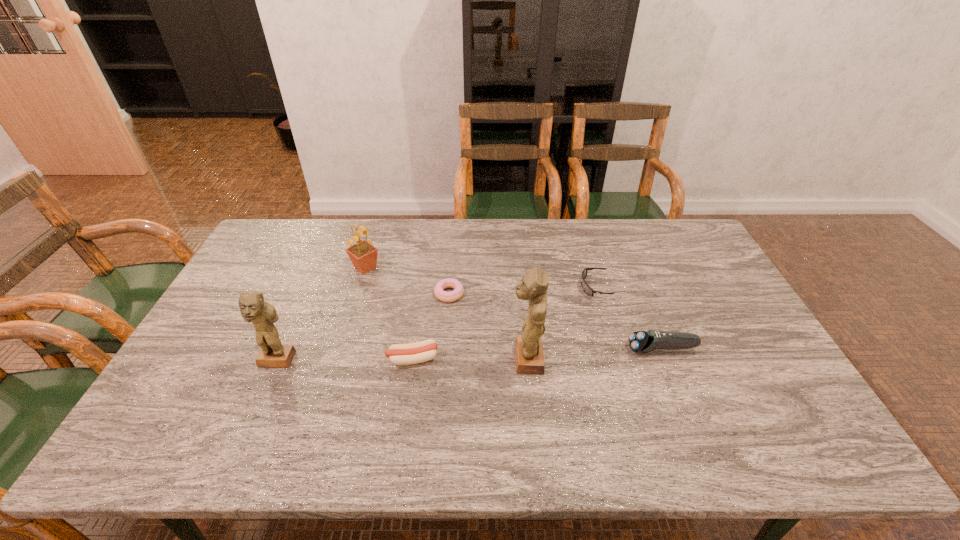
Locate an element on the screen. vacant space located on the head of the fourth shortest object is located at coordinates (529, 349).

I want to click on vacant space positioned on the head of the fourth shortest object, so click(x=540, y=349).

Image resolution: width=960 pixels, height=540 pixels. Find the location of `vacant position located on the right of the sausage`. vacant position located on the right of the sausage is located at coordinates click(584, 359).

At what (x,y) coordinates should I click in order to perform the action: click on object positioned at the far edge. Please return your answer as a coordinate pair (x, y). This screenshot has width=960, height=540. Looking at the image, I should click on (363, 255).

Where is `vacant region at the far edge of the desktop`? The width and height of the screenshot is (960, 540). vacant region at the far edge of the desktop is located at coordinates (540, 242).

This screenshot has height=540, width=960. In order to click on vacant area at the near edge of the desktop in this screenshot , I will do `click(612, 408)`.

Image resolution: width=960 pixels, height=540 pixels. I want to click on vacant region at the left edge of the desktop, so click(x=288, y=270).

At what (x,y) coordinates should I click in order to perform the action: click on free space at the right edge of the desktop. Please return your answer as a coordinate pair (x, y). This screenshot has width=960, height=540. Looking at the image, I should click on (732, 294).

Identify the location of vacant space at the far left corner of the desktop. (300, 225).

Find the location of a particular element. This screenshot has width=960, height=540. vacant space at the near left corner of the desktop is located at coordinates point(193,390).